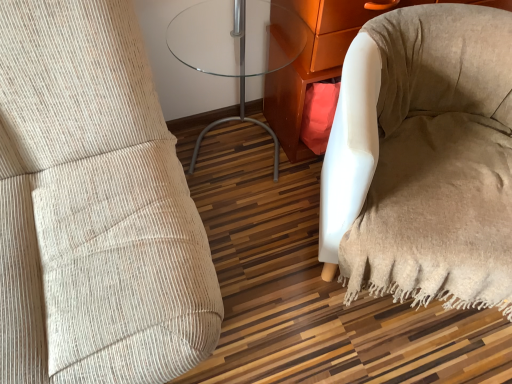
Question: In the image, is white fabric armchair at lower right on the left side or the right side of beige fabric bean bag chair at lower right?

Choices:
 (A) right
 (B) left

Answer: (B)

Question: Is white fabric armchair at lower right spatially inside beige fabric bean bag chair at lower right, or outside of it?

Choices:
 (A) outside
 (B) inside

Answer: (A)

Question: Which object is the farthest from the beige fabric bean bag chair at lower right?

Choices:
 (A) white fabric armchair at lower right
 (B) transparent glass table at center

Answer: (B)

Question: Considering the real-world distances, which object is closest to the transparent glass table at center?

Choices:
 (A) white fabric armchair at lower right
 (B) beige fabric bean bag chair at lower right

Answer: (A)